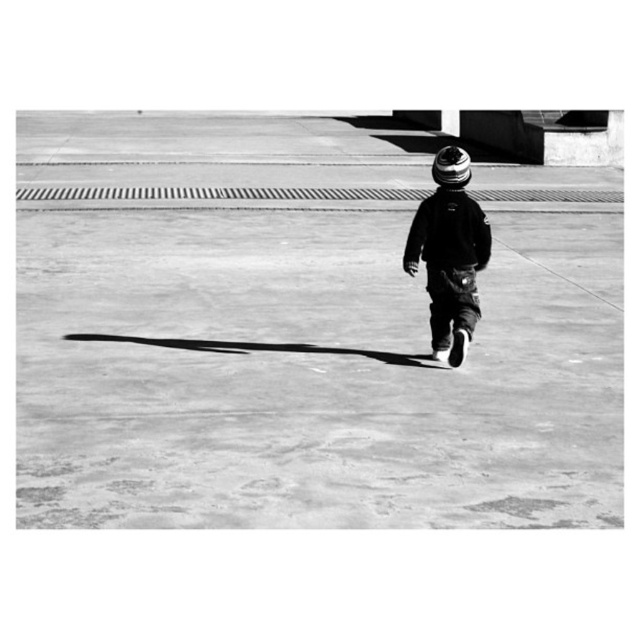
Is point (316, 164) closer to viewer compared to point (464, 208)?

No, (316, 164) is behind (464, 208).

Looking at this image, who is more forward, (365,493) or (420,202)?

Point (365,493) is in front.

Is point (371, 212) positioned in front of point (481, 220)?

No.

You are a GUI agent. You are given a task and a screenshot of the screen. Output one action in this format:
    pyautogui.click(x=<x>, y=<y>)
    Task: Click on the smooth concrete pavement at center
    This screenshot has width=640, height=640.
    Given the screenshot: What is the action you would take?
    (301, 332)

Does smooth concrete pavement at center have a lesser height compared to textured woolen hat at center?

No.

Between point (164, 316) and point (449, 170), which one is positioned in front?

Point (449, 170) is in front.

I want to click on smooth concrete pavement at center, so click(x=301, y=332).

Who is positioned more to the right, striped knit hat at center or textured woolen hat at center?

Positioned to the right is striped knit hat at center.

Who is positioned more to the left, striped knit hat at center or textured woolen hat at center?

Positioned to the left is textured woolen hat at center.

Measure the distance between striped knit hat at center and camera.

They are 27.38 feet apart.

I want to click on striped knit hat at center, so click(x=449, y=253).